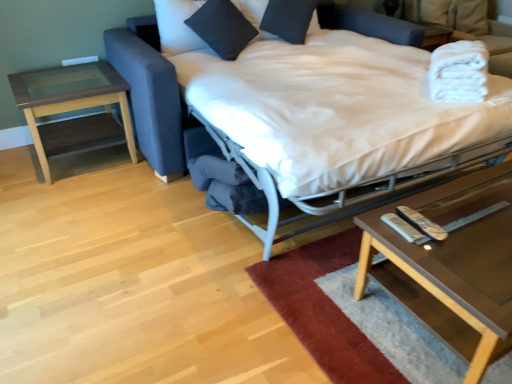
You are a GUI agent. You are given a task and a screenshot of the screen. Output one action in this format:
    pyautogui.click(x=<x>, y=<y>)
    Task: Click on the free spot in front of white plastic remote at lower right, the second remote viewed from the right
    The image size is (512, 384).
    Given the screenshot: What is the action you would take?
    pyautogui.click(x=412, y=254)